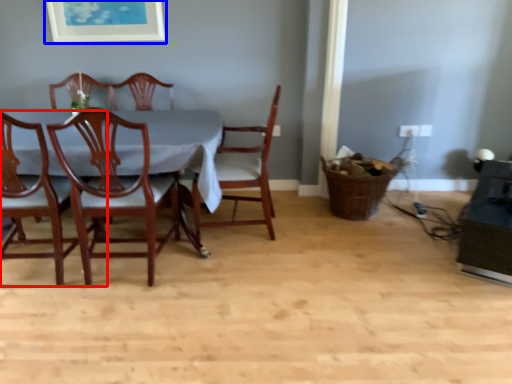
Question: Which of the following is the farthest to the observer, chair (highlighted by a red box) or picture frame (highlighted by a blue box)?

Choices:
 (A) chair
 (B) picture frame

Answer: (B)